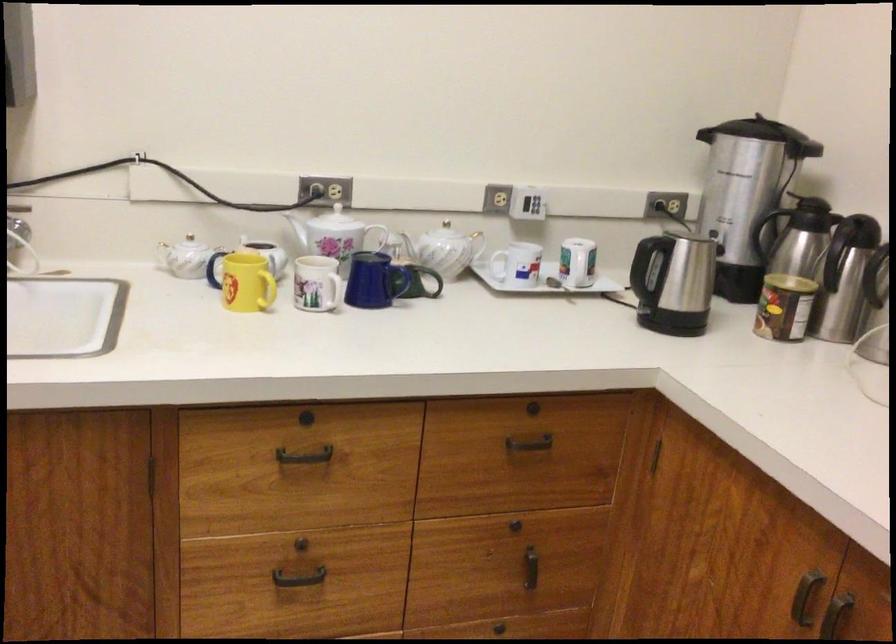
Image resolution: width=896 pixels, height=644 pixels. Identify the location of urn lid handle. (754, 128).